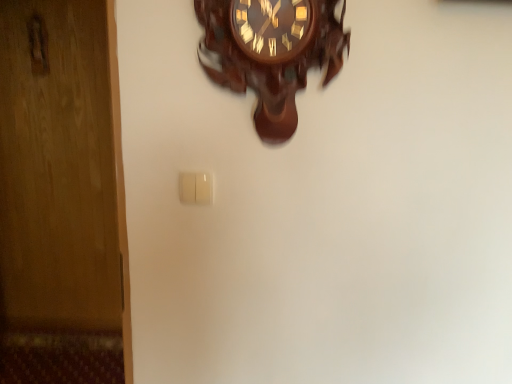
Image resolution: width=512 pixels, height=384 pixels. What do you see at coordinates (272, 52) in the screenshot?
I see `wooden wall clock at upper center` at bounding box center [272, 52].

Find the location of `wooden wall clock at upper center`. wooden wall clock at upper center is located at coordinates (272, 52).

What do you see at coordinates (195, 188) in the screenshot? I see `white plastic light switch at center` at bounding box center [195, 188].

Find the location of `white plastic light switch at center`. white plastic light switch at center is located at coordinates (195, 188).

I want to click on wooden wall clock at upper center, so click(272, 52).

Visually, is white plastic light switch at center positioned to the left or to the right of wooden wall clock at upper center?

In the image, white plastic light switch at center appears on the left side of wooden wall clock at upper center.

Consider the image. Which object is closer to the camera, white plastic light switch at center or wooden wall clock at upper center?

wooden wall clock at upper center.

Is point (206, 180) farther from viewer compared to point (257, 72)?

Yes, it is.

From the image's perspective, is white plastic light switch at center above or below wooden wall clock at upper center?

white plastic light switch at center is below wooden wall clock at upper center.

From a real-world perspective, between white plastic light switch at center and wooden wall clock at upper center, who is vertically lower?

white plastic light switch at center.

Between white plastic light switch at center and wooden wall clock at upper center, which one has smaller width?

Thinner between the two is white plastic light switch at center.

Considering the sizes of objects white plastic light switch at center and wooden wall clock at upper center in the image provided, who is shorter, white plastic light switch at center or wooden wall clock at upper center?

white plastic light switch at center is shorter.

Does white plastic light switch at center have a larger size compared to wooden wall clock at upper center?

No, white plastic light switch at center is not bigger than wooden wall clock at upper center.

Do you think white plastic light switch at center is within wooden wall clock at upper center, or outside of it?

white plastic light switch at center exists outside the volume of wooden wall clock at upper center.

Is white plastic light switch at center not near wooden wall clock at upper center?

No, white plastic light switch at center is in close proximity to wooden wall clock at upper center.

Is white plastic light switch at center oriented away from wooden wall clock at upper center?

white plastic light switch at center does not have its back to wooden wall clock at upper center.

There is a white plastic light switch at center. Identify the location of wall clock above it (from a real-world perspective). (272, 52).

Does wooden wall clock at upper center appear on the left side of white plastic light switch at center?

In fact, wooden wall clock at upper center is to the right of white plastic light switch at center.

Is wooden wall clock at upper center positioned behind white plastic light switch at center?

No, wooden wall clock at upper center is closer to the viewer.

Which is closer to the camera, [294,101] or [188,174]?

The point [294,101] is closer.

From the image's perspective, which is below, wooden wall clock at upper center or white plastic light switch at center?

white plastic light switch at center, from the image's perspective.

From a real-world perspective, does wooden wall clock at upper center sit lower than white plastic light switch at center?

No, from a real-world perspective, wooden wall clock at upper center is not below white plastic light switch at center.

Considering the sizes of objects wooden wall clock at upper center and white plastic light switch at center in the image provided, who is wider, wooden wall clock at upper center or white plastic light switch at center?

wooden wall clock at upper center.

Is wooden wall clock at upper center taller or shorter than white plastic light switch at center?

wooden wall clock at upper center is taller than white plastic light switch at center.

Does wooden wall clock at upper center have a smaller size compared to white plastic light switch at center?

No.

Is wooden wall clock at upper center located outside white plastic light switch at center?

Indeed, wooden wall clock at upper center is completely outside white plastic light switch at center.

Is wooden wall clock at upper center far from white plastic light switch at center?

No.

Does wooden wall clock at upper center turn towards white plastic light switch at center?

No, wooden wall clock at upper center is not aimed at white plastic light switch at center.

Can you tell me how much wooden wall clock at upper center and white plastic light switch at center differ in facing direction?

The facing directions of wooden wall clock at upper center and white plastic light switch at center are 0.00424 degrees apart.

Where is `light switch that appears behind the wooden wall clock at upper center`? light switch that appears behind the wooden wall clock at upper center is located at coordinates (195, 188).

Where is `light switch on the left of the wooden wall clock at upper center`? Image resolution: width=512 pixels, height=384 pixels. light switch on the left of the wooden wall clock at upper center is located at coordinates (195, 188).

The height and width of the screenshot is (384, 512). In order to click on wall clock above the white plastic light switch at center (from the image's perspective) in this screenshot , I will do `click(272, 52)`.